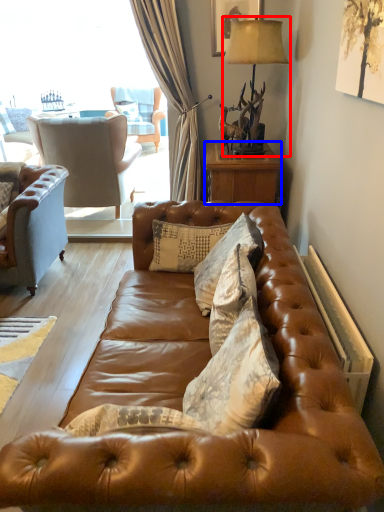
Question: Which object appears closest to the camera in this image, table lamp (highlighted by a red box) or nightstand (highlighted by a blue box)?

Choices:
 (A) table lamp
 (B) nightstand

Answer: (A)